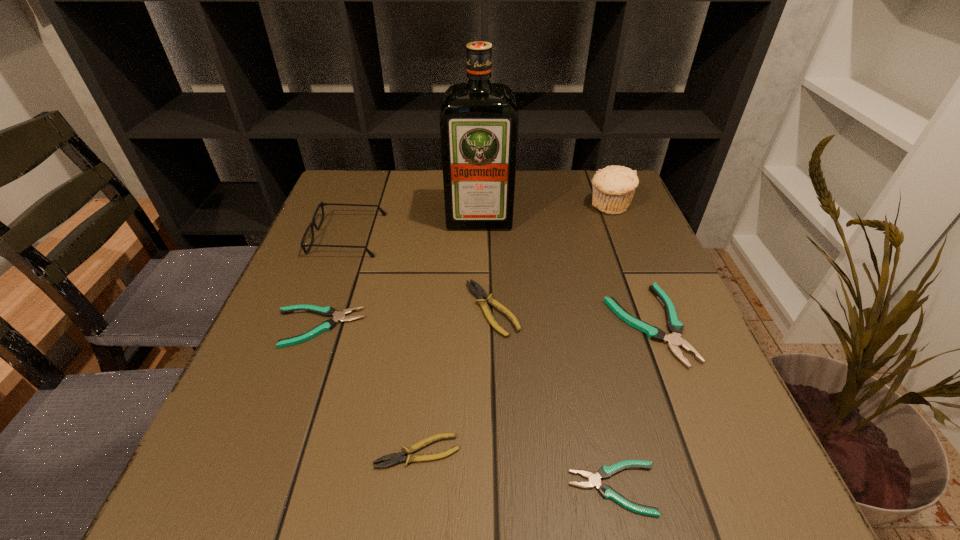
The image size is (960, 540). I want to click on vacant space in between the left yellow pliers and the bigger yellow pliers, so click(455, 380).

Image resolution: width=960 pixels, height=540 pixels. Identify the location of vacant region between the bigger yellow pliers and the muffin. (551, 258).

You are a GUI agent. You are given a task and a screenshot of the screen. Output one action in this format:
    pyautogui.click(x=<x>, y=<y>)
    Task: Click on the vacant space that is in between the shortest object and the muffin
    Image resolution: width=960 pixels, height=540 pixels.
    Given the screenshot: What is the action you would take?
    pyautogui.click(x=612, y=347)

Locate an element on the screen. vacant space that is in between the shortest pliers and the muffin is located at coordinates (612, 347).

At what (x,y) coordinates should I click in order to perform the action: click on unoccupied position between the beige muffin and the leftmost pliers. Please return your answer as a coordinate pair (x, y). The image size is (960, 540). Looking at the image, I should click on pyautogui.click(x=464, y=267).

I want to click on vacant area that lies between the sixth shortest object and the tallest object, so click(414, 226).

Identify the location of unoccupied area between the leftmost pliers and the rightmost pliers. (483, 326).

At what (x,y) coordinates should I click in order to perform the action: click on vacant space in between the liquor and the leftmost teal pliers. Please return your answer as a coordinate pair (x, y). The width and height of the screenshot is (960, 540). Looking at the image, I should click on (398, 272).

Identify the location of object that stands as the seventh closest to the smaller yellow pliers. (613, 186).

Identify which object is the sixth nearest to the second pliers from left to right. Please provide its 2D coordinates. Your answer should be formatted as a tuple, i.e. [(x, y)], where the tuple contains the x and y coordinates of a point satisfying the conditions above.

[(479, 121)]